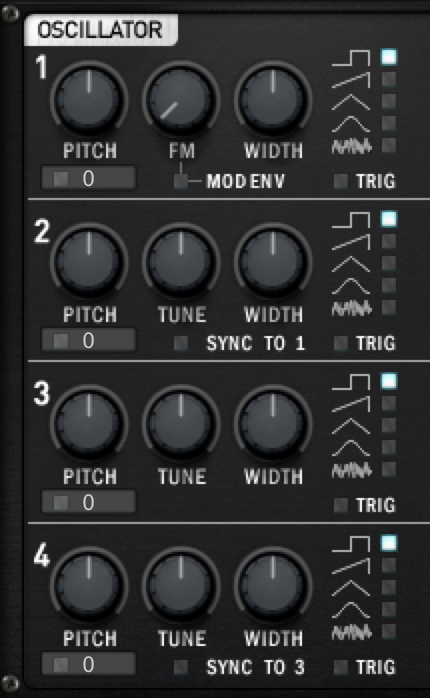
The image size is (430, 698). In order to click on lights in this screenshot , I will do `click(389, 59)`, `click(391, 540)`.